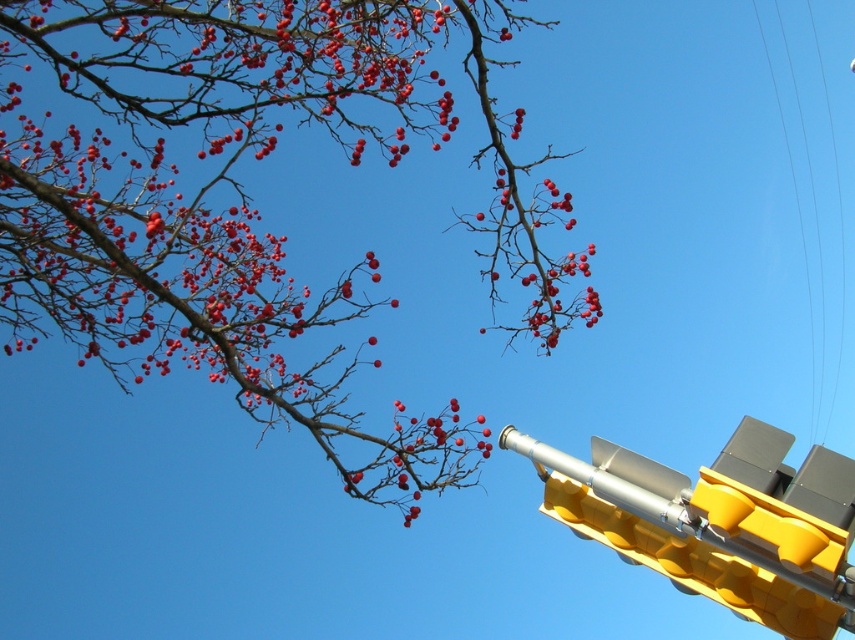
Question: Is smooth red berries at upper left smaller than yellow plastic traffic light at lower right?

Choices:
 (A) no
 (B) yes

Answer: (B)

Question: Among these objects, which one is farthest from the camera?

Choices:
 (A) yellow plastic traffic light at lower right
 (B) smooth red berries at upper left

Answer: (B)

Question: Which of the following is the closest to the observer?

Choices:
 (A) yellow plastic traffic light at lower right
 (B) smooth red berries at upper left

Answer: (A)

Question: Which point is closer to the camera?

Choices:
 (A) (502, 435)
 (B) (51, 205)

Answer: (A)

Question: Is smooth red berries at upper left positioned at the back of yellow plastic traffic light at lower right?

Choices:
 (A) no
 (B) yes

Answer: (B)

Question: From the image, what is the correct spatial relationship of smooth red berries at upper left in relation to yellow plastic traffic light at lower right?

Choices:
 (A) below
 (B) above

Answer: (B)